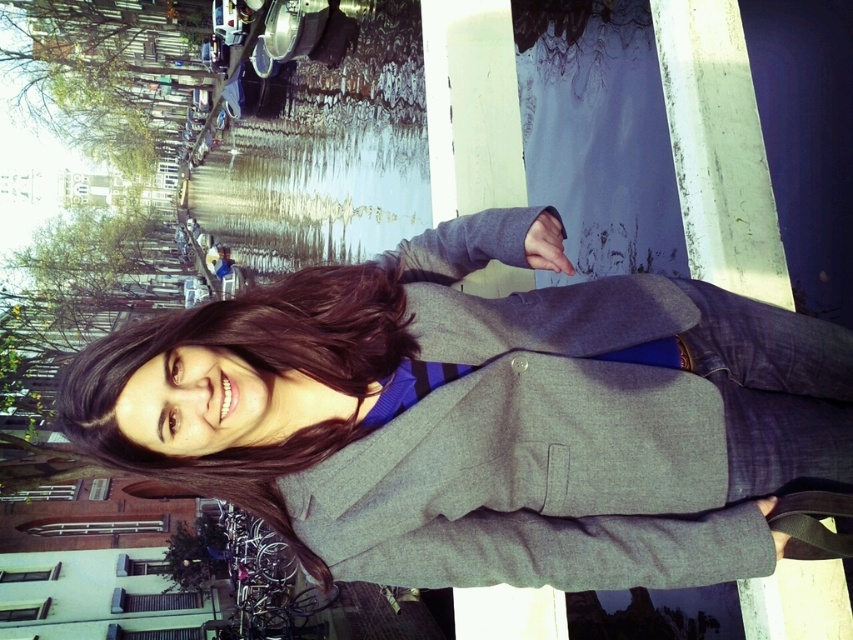
Question: Does gray woolen blazer at center appear under dark brown hair at center?

Choices:
 (A) no
 (B) yes

Answer: (A)

Question: Among these objects, which one is nearest to the camera?

Choices:
 (A) gray woolen blazer at center
 (B) dark brown hair at center

Answer: (A)

Question: Can you confirm if gray woolen blazer at center is positioned below dark brown hair at center?

Choices:
 (A) yes
 (B) no

Answer: (B)

Question: Which of the following is the farthest from the observer?

Choices:
 (A) (103, 388)
 (B) (322, 512)

Answer: (B)

Question: Which of the following is the farthest from the observer?

Choices:
 (A) gray woolen blazer at center
 (B) dark brown hair at center

Answer: (B)

Question: Does gray woolen blazer at center appear under dark brown hair at center?

Choices:
 (A) yes
 (B) no

Answer: (B)